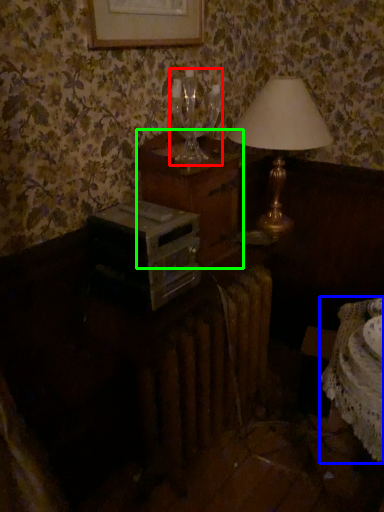
Question: Considering the real-world distances, which object is closest to wine glass (highlighted by a red box)? table (highlighted by a blue box) or nightstand (highlighted by a green box).

Choices:
 (A) table
 (B) nightstand

Answer: (B)